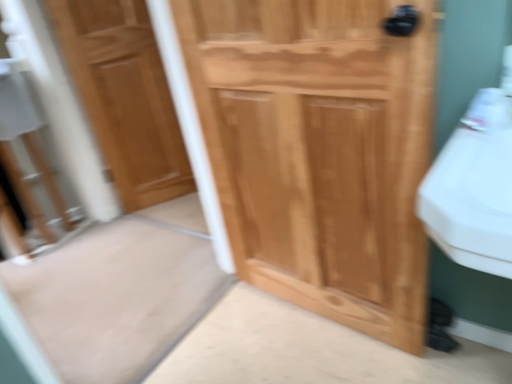
Find the location of a particular element. The height and width of the screenshot is (384, 512). vacant region to the left of natural wood cabinet at center, which is the first door in right-to-left order is located at coordinates (248, 337).